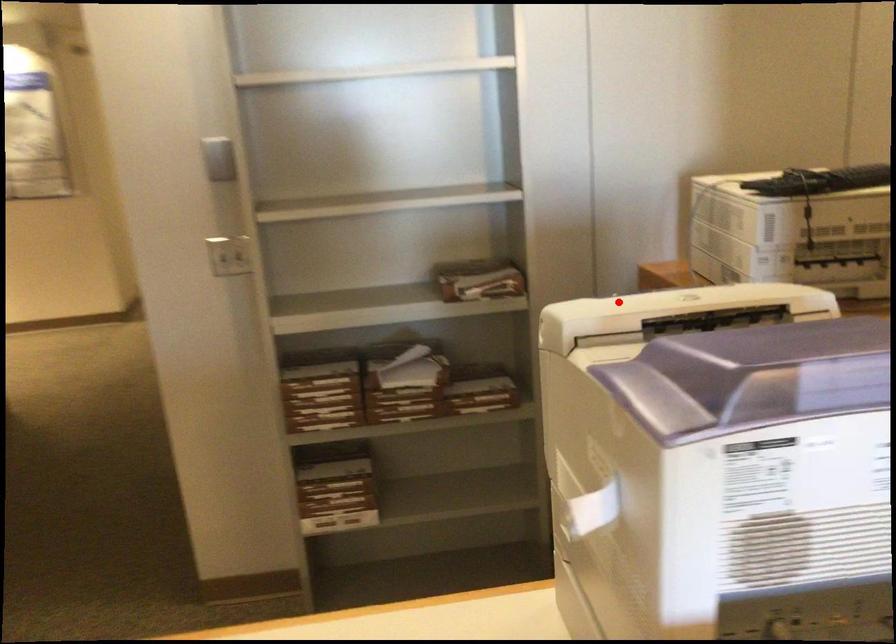
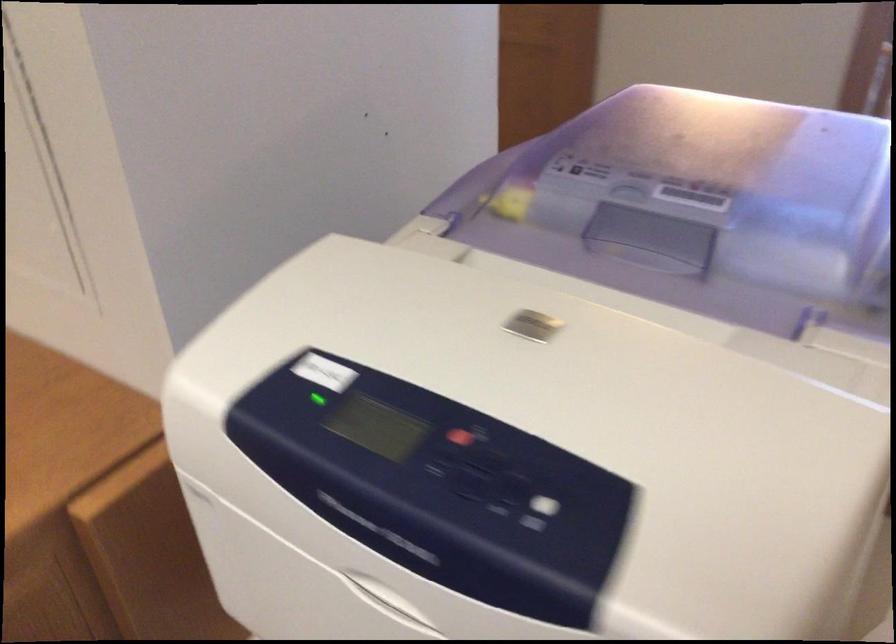
Locate, in the second image, the point that corresponds to the highlighted location in the first image.

(538, 512)